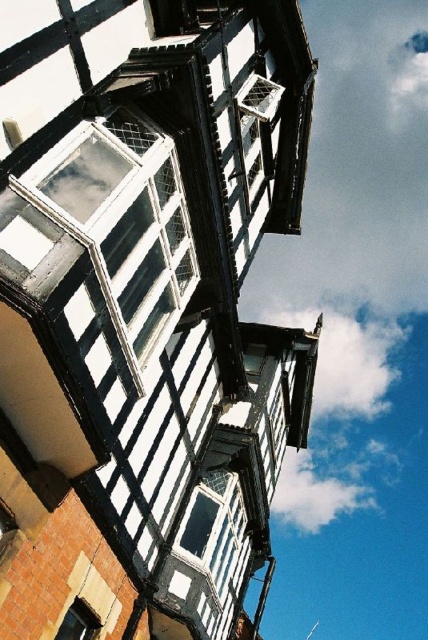
Question: Which of these objects is positioned farthest from the white mesh window at upper center?

Choices:
 (A) white fluffy cloud at upper center
 (B) white painted wood window at upper left
 (C) matte black window at lower left

Answer: (A)

Question: Which object is the farthest from the white painted wood window at upper left?

Choices:
 (A) matte black window at lower left
 (B) white mesh window at upper center
 (C) white fluffy cloud at upper center

Answer: (C)

Question: Which is nearer to the white mesh window at upper center?

Choices:
 (A) white fluffy cloud at upper center
 (B) white painted wood window at upper left
 (C) matte black window at lower left

Answer: (B)

Question: Does white painted wood window at upper left appear over white mesh window at upper center?

Choices:
 (A) yes
 (B) no

Answer: (B)

Question: From the image, what is the correct spatial relationship of white painted wood window at upper left in relation to matte black window at lower left?

Choices:
 (A) below
 (B) above

Answer: (B)

Question: From the image, what is the correct spatial relationship of white painted wood window at upper left in relation to white fluffy cloud at upper center?

Choices:
 (A) right
 (B) left

Answer: (B)